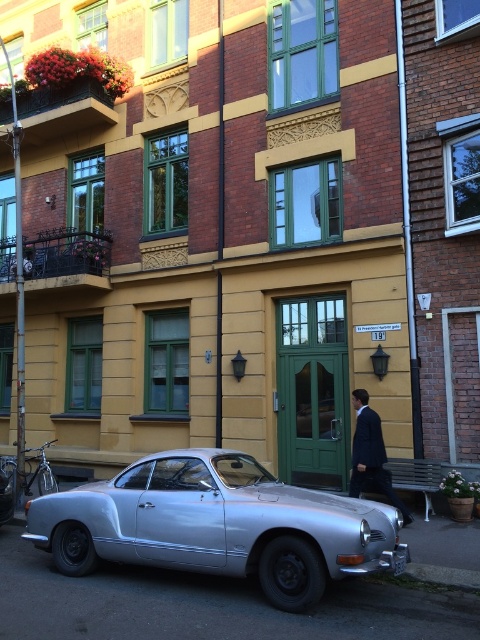
Measure the distance between silver metallic car at center and camera.

silver metallic car at center and camera are 16.80 feet apart.

Image resolution: width=480 pixels, height=640 pixels. I want to click on silver metallic car at center, so click(217, 525).